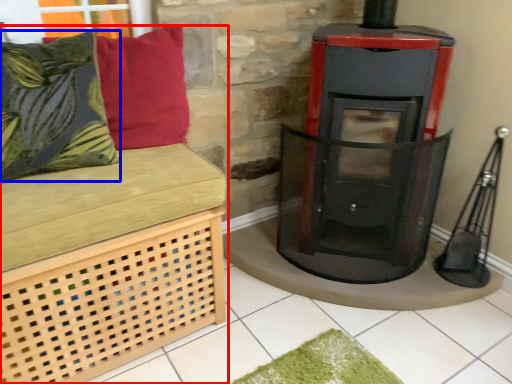
Question: Among these objects, which one is farthest to the camera, furniture (highlighted by a red box) or pillow (highlighted by a blue box)?

Choices:
 (A) furniture
 (B) pillow

Answer: (B)